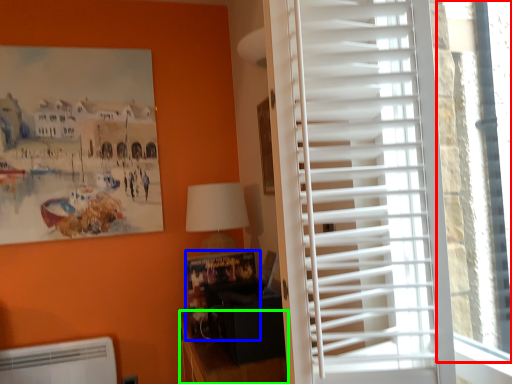
Question: Which is farther away from window screen (highlighted by a red box)? bulletin board (highlighted by a blue box) or furniture (highlighted by a green box)?

Choices:
 (A) bulletin board
 (B) furniture

Answer: (A)